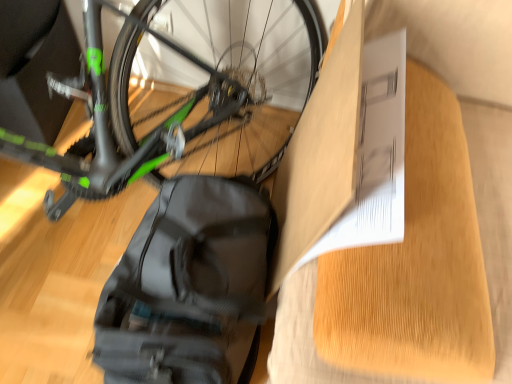
Question: Should I look upward or downward to see black matte backpack at lower left?

Choices:
 (A) up
 (B) down

Answer: (B)

Question: Is matte cardboard box at center positioned behind black matte backpack at lower left?

Choices:
 (A) yes
 (B) no

Answer: (B)

Question: Is matte cardboard box at center beside black matte backpack at lower left?

Choices:
 (A) no
 (B) yes

Answer: (A)

Question: Can you confirm if matte cardboard box at center is taller than black matte backpack at lower left?

Choices:
 (A) yes
 (B) no

Answer: (A)

Question: Does matte cardboard box at center have a greater width compared to black matte backpack at lower left?

Choices:
 (A) no
 (B) yes

Answer: (A)

Question: Is matte cardboard box at center smaller than black matte backpack at lower left?

Choices:
 (A) yes
 (B) no

Answer: (A)

Question: From the image's perspective, is matte cardboard box at center under black matte backpack at lower left?

Choices:
 (A) no
 (B) yes

Answer: (A)

Question: Considering the relative sizes of white paper at upper right and black matte backpack at lower left in the image provided, is white paper at upper right wider than black matte backpack at lower left?

Choices:
 (A) yes
 (B) no

Answer: (A)

Question: Is black matte backpack at lower left at the back of white paper at upper right?

Choices:
 (A) no
 (B) yes

Answer: (A)

Question: From a real-world perspective, does white paper at upper right sit lower than black matte backpack at lower left?

Choices:
 (A) yes
 (B) no

Answer: (B)

Question: From the image's perspective, is white paper at upper right located above black matte backpack at lower left?

Choices:
 (A) no
 (B) yes

Answer: (B)

Question: Is white paper at upper right thinner than black matte backpack at lower left?

Choices:
 (A) no
 (B) yes

Answer: (A)

Question: Can we say white paper at upper right lies outside black matte backpack at lower left?

Choices:
 (A) yes
 (B) no

Answer: (A)

Question: Considering the relative sizes of matte cardboard box at center and white paper at upper right in the image provided, is matte cardboard box at center bigger than white paper at upper right?

Choices:
 (A) no
 (B) yes

Answer: (A)